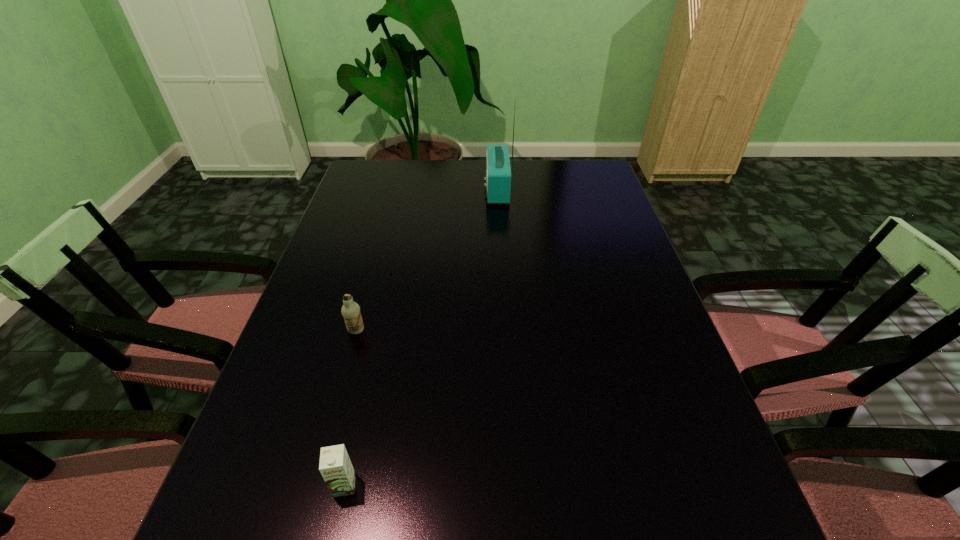
Where is `blank space that satisfies the following two spatial constraints: 1. on the front panel of the rightmost object; 2. on the front side of the left chocolate milk`? blank space that satisfies the following two spatial constraints: 1. on the front panel of the rightmost object; 2. on the front side of the left chocolate milk is located at coordinates (505, 331).

Locate an element on the screen. The height and width of the screenshot is (540, 960). vacant space that satisfies the following two spatial constraints: 1. on the front panel of the farthest object; 2. on the front side of the nearest object is located at coordinates (514, 485).